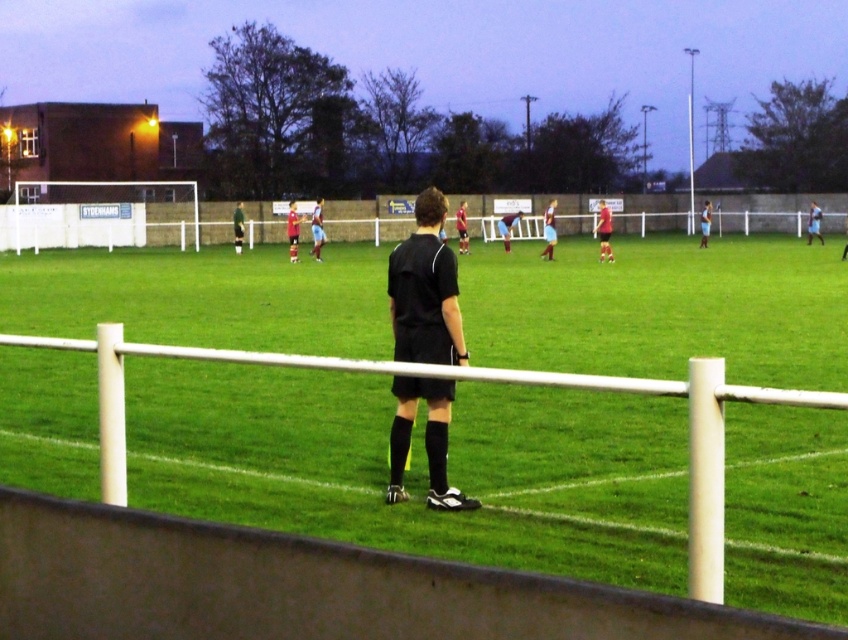
You are a soccer player who needs to retrieve your black jersey at center from the field. The referee, dressed in a black matte referee at center, is standing between you and your jersey. Can you safely approach your jersey without crossing into the referee? Please consider the distance between them.

The black matte referee at center and black jersey at center are 32.33 meters apart. Since the distance is quite large, you can safely approach your jersey without crossing into the referee as there is enough space between them.

You are a photographer taking a picture of the soccer field. You notice two points marked on your viewfinder at coordinates point (604, 218) and point (293, 218). Which point will appear larger in your photo?

Point (604, 218) will appear larger in the photo because it is closer to the camera than point (293, 218).

You are a soccer player on the field and you see the black jersey at center and the dark green jersey at center. Which one is lower in position?

The black jersey at center is below dark green jersey at center, so the black jersey at center is lower in position.